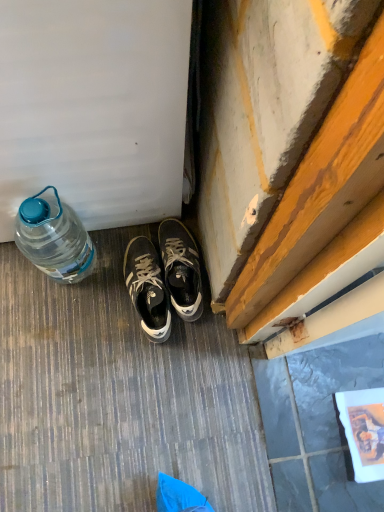
Question: Is translucent plastic bottle at left positioned in front of dark gray leather sneakers at center, which appears as the 1th sneakers when viewed from the left?

Choices:
 (A) no
 (B) yes

Answer: (B)

Question: From the image's perspective, is translucent plastic bottle at left under dark gray leather sneakers at center, which appears as the 1th sneakers when viewed from the left?

Choices:
 (A) no
 (B) yes

Answer: (A)

Question: Is translucent plastic bottle at left thinner than dark gray leather sneakers at center, which appears as the 1th sneakers when viewed from the left?

Choices:
 (A) no
 (B) yes

Answer: (B)

Question: From the image's perspective, would you say translucent plastic bottle at left is positioned over dark gray leather sneakers at center, the 2th sneakers when ordered from right to left?

Choices:
 (A) yes
 (B) no

Answer: (A)

Question: Does translucent plastic bottle at left have a lesser height compared to dark gray leather sneakers at center, the 2th sneakers when ordered from right to left?

Choices:
 (A) yes
 (B) no

Answer: (B)

Question: From the image's perspective, relative to translucent plastic bottle at left, is dark gray leather sneakers at center, which appears as the 1th sneakers when viewed from the left, above or below?

Choices:
 (A) above
 (B) below

Answer: (B)

Question: Would you say dark gray leather sneakers at center, the 2th sneakers when ordered from right to left, is to the left or to the right of translucent plastic bottle at left in the picture?

Choices:
 (A) left
 (B) right

Answer: (B)

Question: In the image, is dark gray leather sneakers at center, which appears as the 1th sneakers when viewed from the left, positioned in front of or behind translucent plastic bottle at left?

Choices:
 (A) behind
 (B) front

Answer: (A)

Question: Is dark gray leather sneakers at center, which appears as the 1th sneakers when viewed from the left, situated inside translucent plastic bottle at left or outside?

Choices:
 (A) outside
 (B) inside

Answer: (A)

Question: Would you say matte black sneakers at center, positioned as the second sneakers in left-to-right order, is inside or outside translucent plastic bottle at left?

Choices:
 (A) inside
 (B) outside

Answer: (B)

Question: Visually, is matte black sneakers at center, the first sneakers when ordered from right to left, positioned to the left or to the right of translucent plastic bottle at left?

Choices:
 (A) right
 (B) left

Answer: (A)

Question: From the image's perspective, is matte black sneakers at center, the first sneakers when ordered from right to left, above or below translucent plastic bottle at left?

Choices:
 (A) below
 (B) above

Answer: (A)

Question: Is point (170, 300) positioned closer to the camera than point (87, 271)?

Choices:
 (A) farther
 (B) closer

Answer: (B)

Question: Relative to matte black sneakers at center, positioned as the second sneakers in left-to-right order, is translucent plastic bottle at left in front or behind?

Choices:
 (A) behind
 (B) front

Answer: (B)

Question: Is translucent plastic bottle at left to the left or to the right of matte black sneakers at center, the first sneakers when ordered from right to left, in the image?

Choices:
 (A) left
 (B) right

Answer: (A)